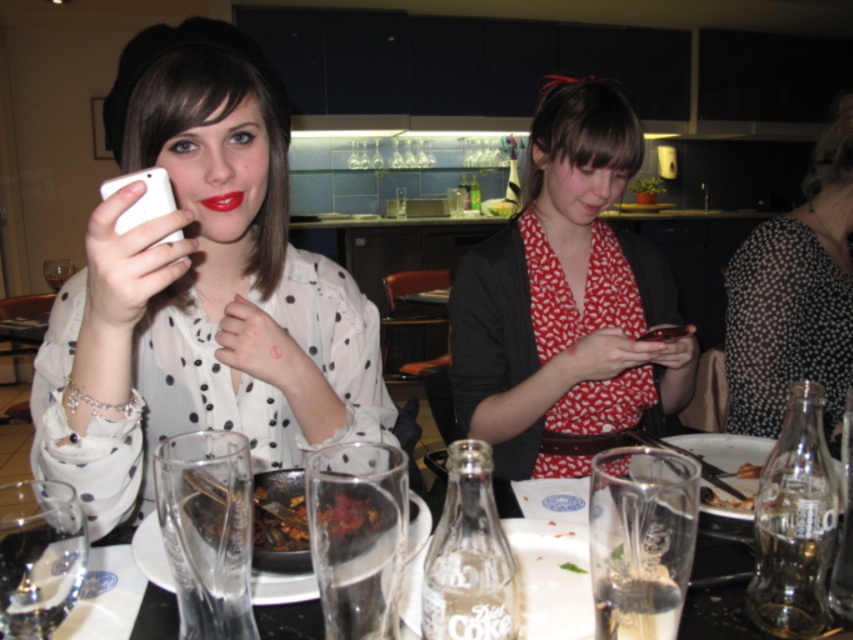
You are a photographer trying to capture a candid shot of the scene. Given that the matte white phone at upper left and the black dotted dress at right are both in your viewfinder, which object should you focus on to ensure it takes up more of the frame?

The black dotted dress at right should be focused on because it occupies more space than the matte white phone at upper left, making it a better candidate to fill the frame.

You are a photographer at the scene and want to capture a photo that includes both the matte white phone at upper left and the black dotted dress at right. Which object should be placed to the left in the frame to ensure both are visible?

The matte white phone at upper left should be placed to the left of the black dotted dress at right in the frame since it is already positioned on the left side of the black dotted dress at right.